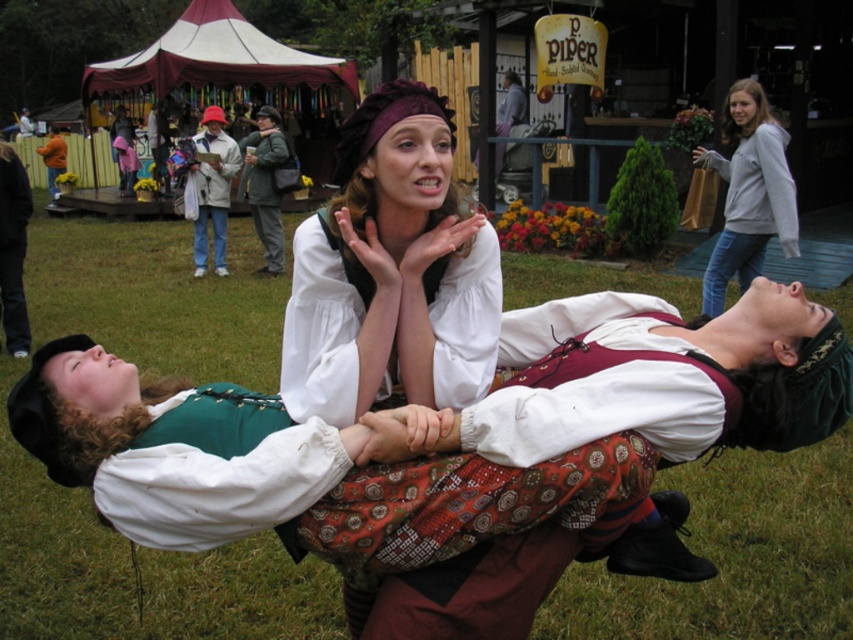
You are a costume designer preparing for a play and need to ensure that the white cotton blouse at center and the white cotton coat at center can both fit in a storage box. The box can only hold items that take up the same amount of space. Based on the image, will both items fit in the box?

The white cotton blouse at center occupies less space than white cotton coat at center, so they do not take up the same amount of space. Therefore, both items cannot fit in the storage box designed for items of equal space.

You are an event photographer at the Renaissance fair. You need to capture a clear photo of both the white cotton blouse at center and the white cotton coat at center. Which one will appear larger in your photo?

The white cotton blouse at center will appear larger in the photo because it is closer to the viewer than the white cotton coat at center.

You are a photographer at the Renaissance fair. You want to capture a photo that emphasizes the green grass at center without making the white cotton blouse at center look too large. Which object should you focus on and why?

You should focus on the green grass at center because it is bigger than the white cotton blouse at center, so emphasizing it would naturally draw attention away from the blouse.